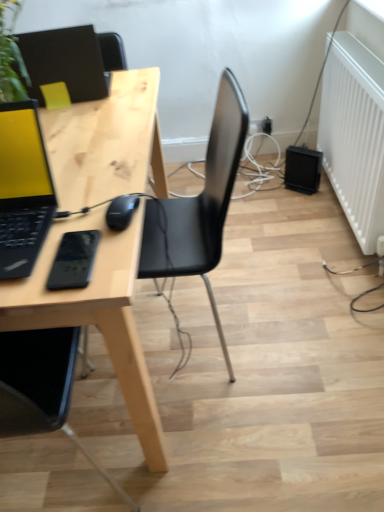
Find the location of a particular element. The width and height of the screenshot is (384, 512). free point to the right of matte black laptop at upper left, arranged as the 1th laptop when viewed from the back is located at coordinates (135, 91).